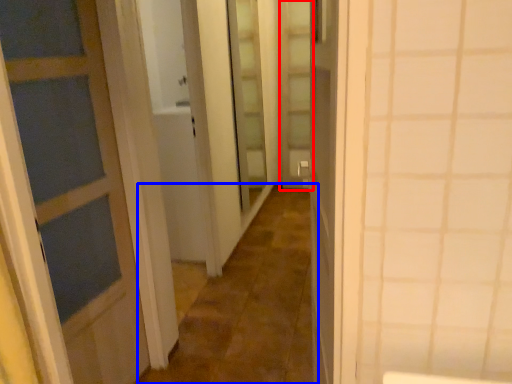
Question: Which of the following is the farthest to the observer, screen door (highlighted by a red box) or alley (highlighted by a blue box)?

Choices:
 (A) screen door
 (B) alley

Answer: (A)